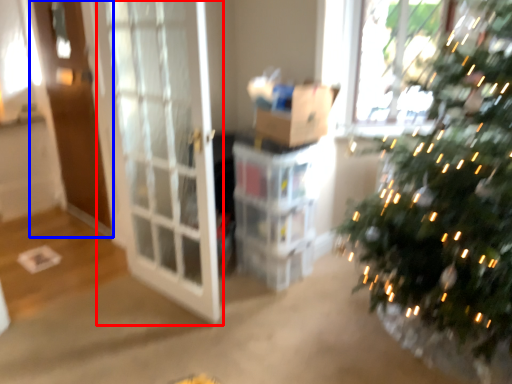
Question: Which of the following is the closest to the observer, screen door (highlighted by a red box) or screen door (highlighted by a blue box)?

Choices:
 (A) screen door
 (B) screen door

Answer: (A)